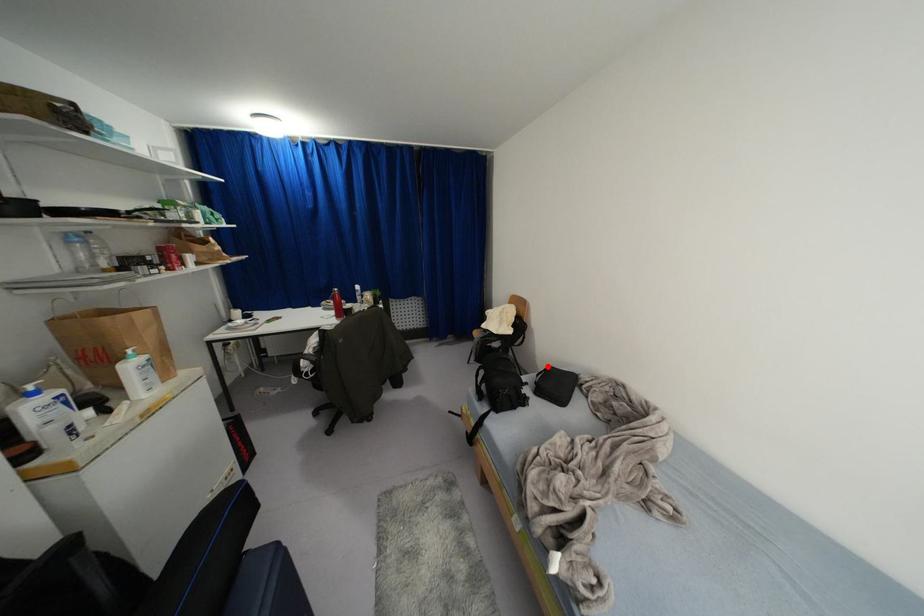
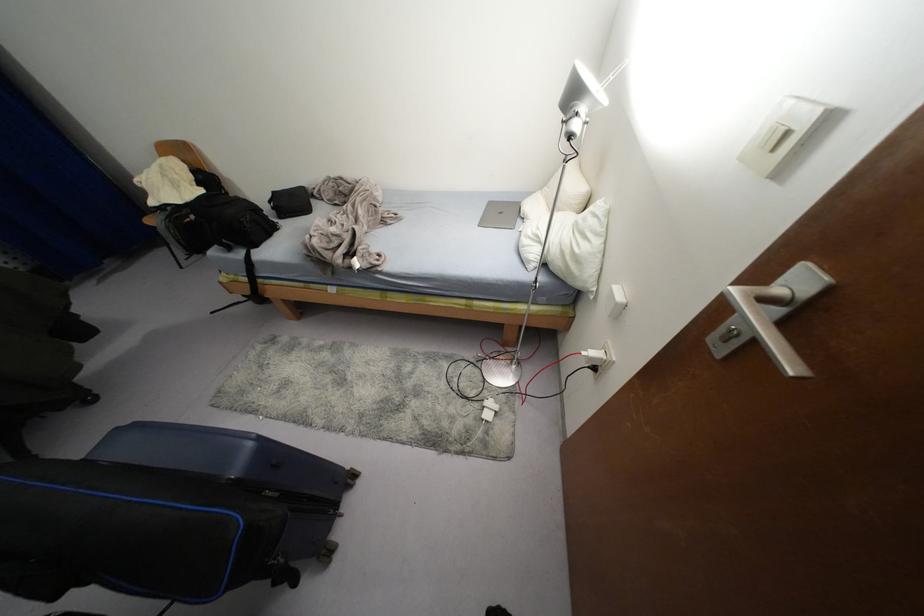
Question: I am providing you with two images of the same scene from different viewpoints. A red point is shown in image1. For the corresponding object point in image2, is it positioned nearer or farther from the camera?

Choices:
 (A) Nearer
 (B) Farther

Answer: (B)